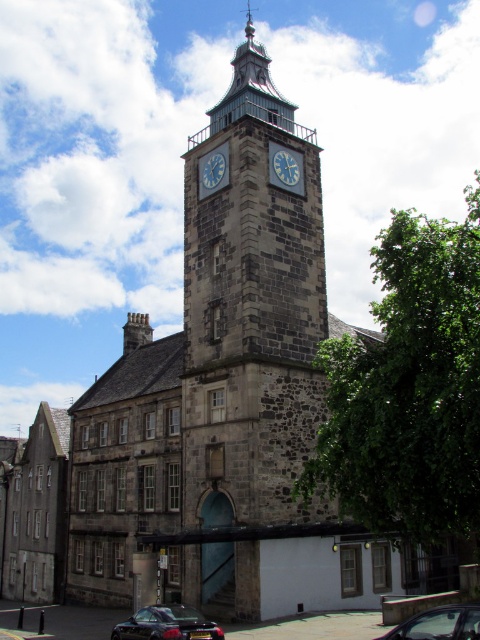
Question: Is the position of stone clock tower at center more distant than that of blue painted metal clock at center?

Choices:
 (A) yes
 (B) no

Answer: (B)

Question: Can you confirm if shiny black car at lower left is bigger than blue metallic clock at center?

Choices:
 (A) yes
 (B) no

Answer: (A)

Question: Which object is closer to the camera taking this photo?

Choices:
 (A) metallic silver car at lower center
 (B) blue painted metal clock at center

Answer: (A)

Question: Does shiny black car at lower left appear on the left side of blue metallic clock at center?

Choices:
 (A) no
 (B) yes

Answer: (B)

Question: Which point is closer to the camera?

Choices:
 (A) (190, 609)
 (B) (291, 186)
 (C) (203, 170)
 (D) (457, 627)

Answer: (D)

Question: Which point is closer to the camera taking this photo?

Choices:
 (A) (214, 172)
 (B) (434, 637)

Answer: (B)